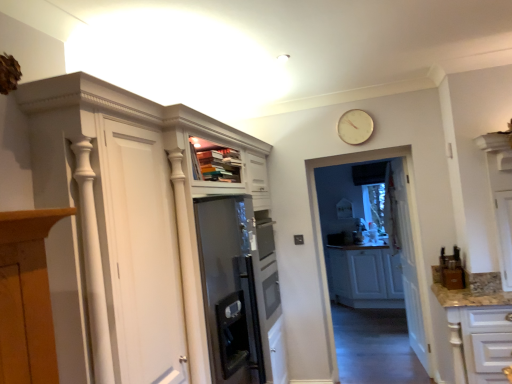
Question: Is white glossy cabinet at lower right, the 1th cabinetry when ordered from front to back, inside the boundaries of white wooden door at center, or outside?

Choices:
 (A) inside
 (B) outside

Answer: (B)

Question: In terms of height, does white glossy cabinet at lower right, the 1th cabinetry when ordered from front to back, look taller or shorter compared to white wooden door at center?

Choices:
 (A) short
 (B) tall

Answer: (A)

Question: Which is nearer to the white glossy cabinet at lower right, the 1th cabinetry when ordered from front to back?

Choices:
 (A) white matte cabinet at center, the second cabinetry from the front
 (B) gold metallic clock at upper center
 (C) transparent glass door at center
 (D) white wooden door at center
 (E) white glossy cupboard at upper left

Answer: (C)

Question: Estimate the real-world distances between objects in this image. Which object is closer to the transparent glass door at center?

Choices:
 (A) gold metallic clock at upper center
 (B) white matte cabinet at center, the second cabinetry from the front
 (C) white glossy cabinet at lower right, the 1th cabinetry when ordered from front to back
 (D) white wooden door at center
 (E) white glossy cupboard at upper left

Answer: (D)